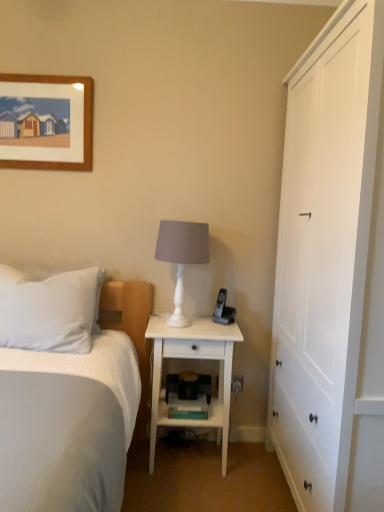
The height and width of the screenshot is (512, 384). Describe the element at coordinates (74, 414) in the screenshot. I see `white textured bed at left` at that location.

This screenshot has height=512, width=384. What do you see at coordinates (324, 256) in the screenshot?
I see `white wood cabinet at right` at bounding box center [324, 256].

Based on the photo, in order to face black plastic phone at right, should I rotate leftwards or rightwards?

Rotate your view right by about 4.377°.

I want to click on white soft pillow at left, so click(x=48, y=310).

Does black plastic phone at right have a greater height compared to white textured bed at left?

No, black plastic phone at right is not taller than white textured bed at left.

From the picture: Is the depth of black plastic phone at right greater than that of white textured bed at left?

Yes, black plastic phone at right is further from the viewer.

Considering the relative sizes of black plastic phone at right and white textured bed at left in the image provided, is black plastic phone at right thinner than white textured bed at left?

Correct, the width of black plastic phone at right is less than that of white textured bed at left.

Is white matte lamp at center to the left of white wood cabinet at right from the viewer's perspective?

Yes.

You are a GUI agent. You are given a task and a screenshot of the screen. Output one action in this format:
    pyautogui.click(x=<x>, y=<y>)
    Task: Click on the cabinetry on the right of white matte lamp at center
    
    Given the screenshot: What is the action you would take?
    pyautogui.click(x=324, y=256)

Does white matte lamp at center have a smaller size compared to white wood cabinet at right?

Yes.

From the image's perspective, which one is positioned higher, white matte lamp at center or white wood cabinet at right?

From the image's view, white matte lamp at center is above.

Measure the distance between white matte lamp at center and white soft pillow at left.

white matte lamp at center and white soft pillow at left are 20.65 inches apart.

Based on the photo, from the image's perspective, is white matte lamp at center located above or below white soft pillow at left?

white matte lamp at center is situated higher than white soft pillow at left in the image.

Which object is closer to the camera, white matte lamp at center or white soft pillow at left?

white soft pillow at left is in front.

Is white matte lamp at center taller or shorter than white soft pillow at left?

In the image, white matte lamp at center appears to be taller than white soft pillow at left.

Where is `cabinetry above the black plastic phone at right (from the image's perspective)`? cabinetry above the black plastic phone at right (from the image's perspective) is located at coordinates (324, 256).

From the image's perspective, is black plastic phone at right over white wood cabinet at right?

No, from the image's perspective, black plastic phone at right is not over white wood cabinet at right.

Is the depth of black plastic phone at right greater than that of white wood cabinet at right?

Yes, it is.

Is white wood cabinet at right surrounded by black plastic phone at right?

No, white wood cabinet at right is not a part of black plastic phone at right.

Could you tell me if black plastic phone at right is turned towards white wood nightstand at center?

No, black plastic phone at right is not turned towards white wood nightstand at center.

Is black plastic phone at right not within white wood nightstand at center?

Yes, black plastic phone at right is not within white wood nightstand at center.

Which is behind, point (232, 319) or point (199, 421)?

Positioned behind is point (232, 319).

Can you confirm if white wood cabinet at right is thinner than black plastic phone at right?

No.

Between white wood cabinet at right and black plastic phone at right, which one is positioned behind?

black plastic phone at right is behind.

Measure the distance between white wood cabinet at right and black plastic phone at right.

white wood cabinet at right and black plastic phone at right are 30.94 inches apart.

Would you say black plastic phone at right is part of white wood cabinet at right's contents?

No, white wood cabinet at right does not contain black plastic phone at right.

From the image's perspective, does white wood cabinet at right appear higher than white soft pillow at left?

Correct, white wood cabinet at right appears higher than white soft pillow at left in the image.

Who is bigger, white wood cabinet at right or white soft pillow at left?

Bigger between the two is white wood cabinet at right.

How distant is white wood cabinet at right from white soft pillow at left?

The distance of white wood cabinet at right from white soft pillow at left is 1.10 meters.

Considering the relative sizes of white wood cabinet at right and white soft pillow at left in the image provided, is white wood cabinet at right taller than white soft pillow at left?

Yes.

The width and height of the screenshot is (384, 512). I want to click on corded phone located behind the white textured bed at left, so click(223, 309).

Where is `cabinetry that appears below the white matte lamp at center (from the image's perspective)`? This screenshot has width=384, height=512. cabinetry that appears below the white matte lamp at center (from the image's perspective) is located at coordinates (324, 256).

Based on the photo, considering their positions, is white textured bed at left positioned closer to black plastic phone at right than white wood cabinet at right?

white wood cabinet at right is positioned closer to the anchor black plastic phone at right.

When comparing their distances from black plastic phone at right, does white textured bed at left or white wood nightstand at center seem further?

Based on the image, white textured bed at left appears to be further to black plastic phone at right.

Estimate the real-world distances between objects in this image. Which object is further from white textured bed at left, white wood cabinet at right or white matte lamp at center?

The object further to white textured bed at left is white wood cabinet at right.

Estimate the real-world distances between objects in this image. Which object is closer to white textured bed at left, white matte lamp at center or white soft pillow at left?

white soft pillow at left lies closer to white textured bed at left than the other object.

Looking at the image, which one is located further to white wood cabinet at right, white wood nightstand at center or black plastic phone at right?

black plastic phone at right lies further to white wood cabinet at right than the other object.

Based on their spatial positions, is white soft pillow at left or black plastic phone at right further from white textured bed at left?

The object further to white textured bed at left is black plastic phone at right.

From the image, which object appears to be farther from white textured bed at left, white wood nightstand at center or black plastic phone at right?

black plastic phone at right is further to white textured bed at left.

Looking at the image, which one is located closer to white matte lamp at center, white textured bed at left or white wood cabinet at right?

white textured bed at left is closer to white matte lamp at center.

Where is `nightstand between white textured bed at left and black plastic phone at right along the z-axis`? Image resolution: width=384 pixels, height=512 pixels. nightstand between white textured bed at left and black plastic phone at right along the z-axis is located at coordinates (193, 359).

Where is `lamp located between white wood cabinet at right and white wood nightstand at center in the depth direction`? lamp located between white wood cabinet at right and white wood nightstand at center in the depth direction is located at coordinates (182, 256).

This screenshot has height=512, width=384. I want to click on lamp between white textured bed at left and white wood nightstand at center in the front-back direction, so click(x=182, y=256).

Find the location of a particular element. nightstand between white soft pillow at left and black plastic phone at right in the horizontal direction is located at coordinates (193, 359).